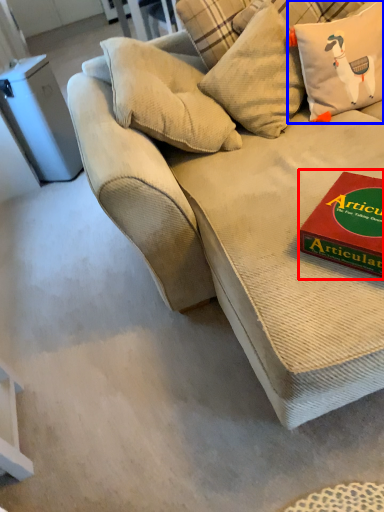
Question: Which object is further to the camera taking this photo, paperback book (highlighted by a red box) or pillow (highlighted by a blue box)?

Choices:
 (A) paperback book
 (B) pillow

Answer: (B)